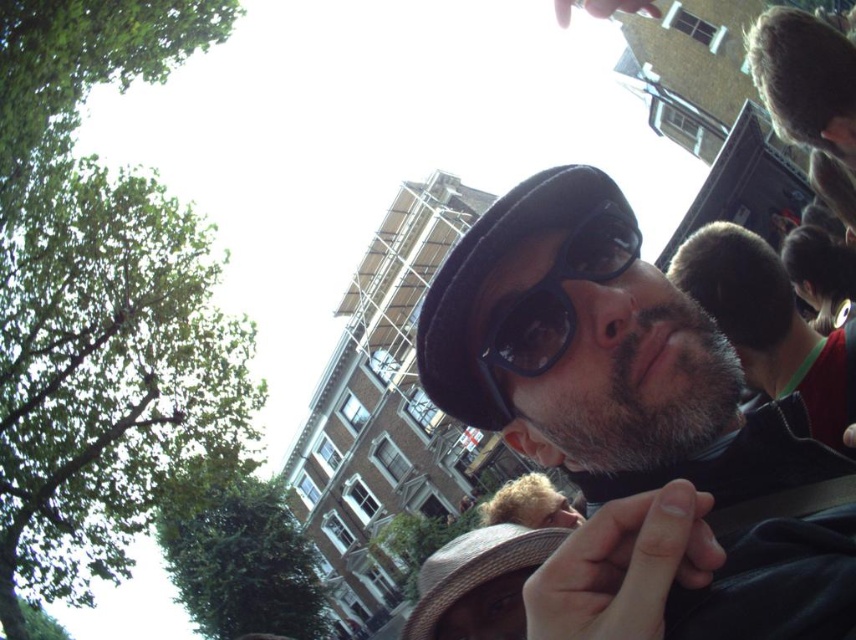
Question: Which point is farther to the camera?

Choices:
 (A) gray fuzzy hat at upper right
 (B) blonde hair at center

Answer: (B)

Question: Is matte black hat at center behind blonde hair at center?

Choices:
 (A) no
 (B) yes

Answer: (A)

Question: Which point is closer to the camera?

Choices:
 (A) (607, 259)
 (B) (742, 349)
 (C) (467, 584)

Answer: (A)

Question: In this image, where is matte black hat at center located relative to black plastic goggles at center?

Choices:
 (A) right
 (B) left

Answer: (A)

Question: Which of the following is the farthest from the observer?

Choices:
 (A) gray fuzzy hat at upper right
 (B) brown straw hat at lower center
 (C) black plastic goggles at center

Answer: (B)

Question: Can you confirm if matte black hat at center is thinner than brown straw hat at lower center?

Choices:
 (A) no
 (B) yes

Answer: (A)